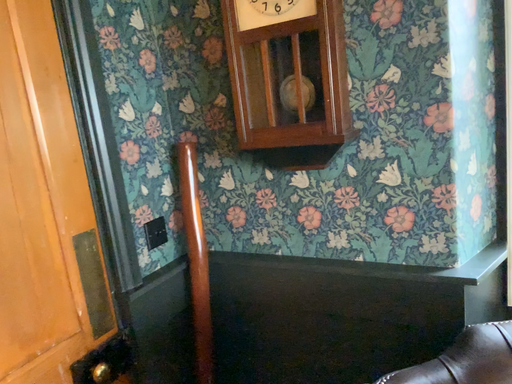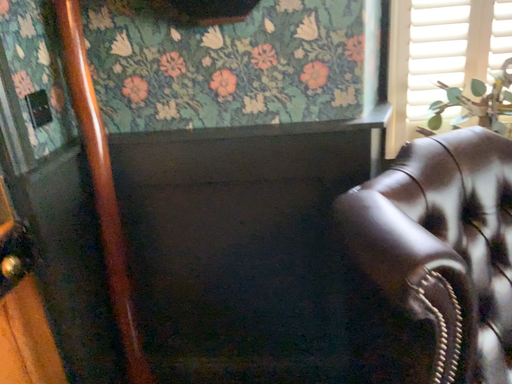
Question: Which way did the camera rotate in the video?

Choices:
 (A) rotated left
 (B) rotated right

Answer: (B)